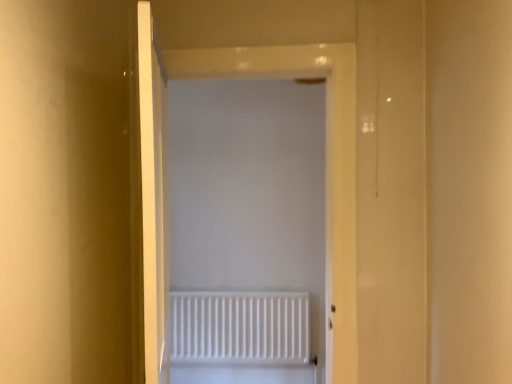
Question: Is point (280, 360) closer or farther from the camera than point (202, 77)?

Choices:
 (A) farther
 (B) closer

Answer: (A)

Question: Relative to white matte radiator at center, is white matte radiator at center in front or behind?

Choices:
 (A) behind
 (B) front

Answer: (A)

Question: From a real-world perspective, is white matte radiator at center positioned above or below white matte radiator at center?

Choices:
 (A) above
 (B) below

Answer: (B)

Question: In terms of height, does white matte radiator at center look taller or shorter compared to white matte radiator at center?

Choices:
 (A) tall
 (B) short

Answer: (A)

Question: Is white matte radiator at center bigger or smaller than white matte radiator at center?

Choices:
 (A) big
 (B) small

Answer: (A)

Question: Is white matte radiator at center inside the boundaries of white matte radiator at center, or outside?

Choices:
 (A) inside
 (B) outside

Answer: (B)

Question: Is white matte radiator at center to the left or to the right of white matte radiator at center in the image?

Choices:
 (A) right
 (B) left

Answer: (A)